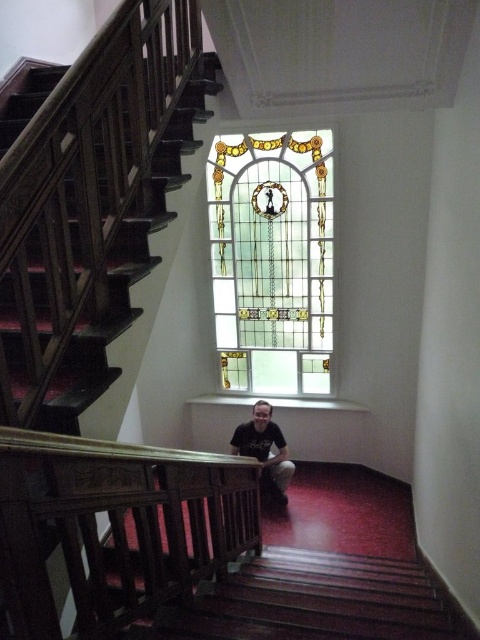
You are standing at the bottom of the staircase and see the dark brown wooden balustrade at center and the matte black shirt at center. Which object is closer to you?

The dark brown wooden balustrade at center is closer to the viewer than the matte black shirt at center.

You are standing in the room and want to take a photo of the stained glass window at center without including the dark brown wooden balustrade at center in the frame. Which direction should you move to achieve this?

Move to the right side of the room so that the dark brown wooden balustrade at center is no longer in the frame, as it is to the left of the stained glass window at center.